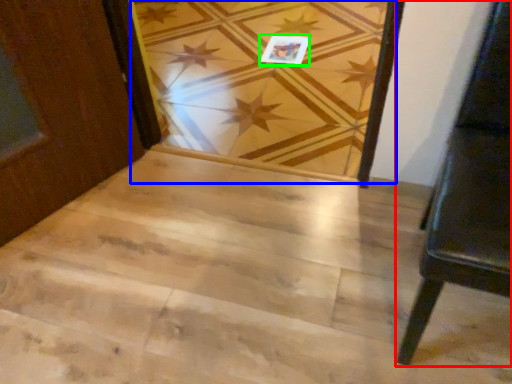
Question: Which object is positioned farthest from furniture (highlighted by a red box)? Select from plank (highlighted by a blue box) and postcard (highlighted by a green box).

Choices:
 (A) plank
 (B) postcard

Answer: (B)